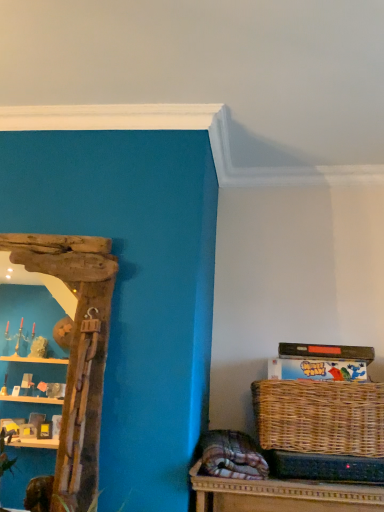
Question: Considering the positions of driftwood mirror at left and woven brown picnic basket at lower right in the image, is driftwood mirror at left wider or thinner than woven brown picnic basket at lower right?

Choices:
 (A) thin
 (B) wide

Answer: (A)

Question: Would you say driftwood mirror at left is to the left or to the right of woven brown picnic basket at lower right in the picture?

Choices:
 (A) right
 (B) left

Answer: (B)

Question: From the image's perspective, is driftwood mirror at left located above or below woven brown picnic basket at lower right?

Choices:
 (A) below
 (B) above

Answer: (B)

Question: From a real-world perspective, relative to driftwood mirror at left, is woven brown picnic basket at lower right vertically above or below?

Choices:
 (A) below
 (B) above

Answer: (A)

Question: In the image, is woven brown picnic basket at lower right positioned in front of or behind driftwood mirror at left?

Choices:
 (A) behind
 (B) front

Answer: (A)

Question: Does point (370, 415) appear closer or farther from the camera than point (87, 310)?

Choices:
 (A) farther
 (B) closer

Answer: (B)

Question: In terms of height, does woven brown picnic basket at lower right look taller or shorter compared to driftwood mirror at left?

Choices:
 (A) tall
 (B) short

Answer: (B)